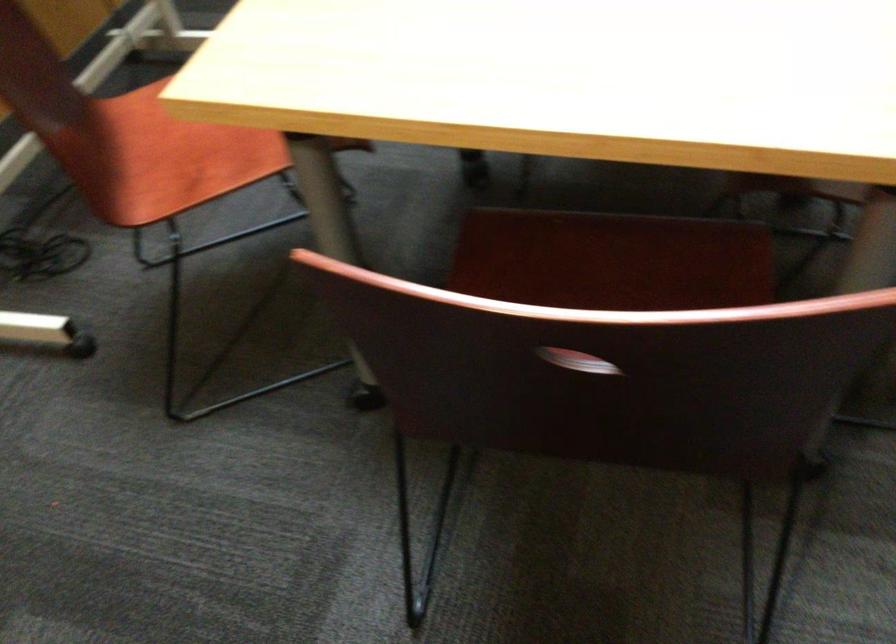
This screenshot has width=896, height=644. What do you see at coordinates (182, 156) in the screenshot? I see `a brown chair sitting surface` at bounding box center [182, 156].